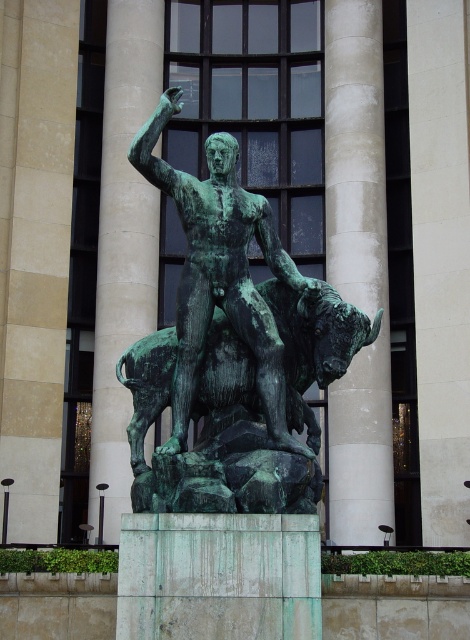
Question: Does smooth stone pillar at center have a lesser width compared to green patina statue at center?

Choices:
 (A) yes
 (B) no

Answer: (A)

Question: Considering the real-world distances, which object is farthest from the smooth stone pillar at center?

Choices:
 (A) green patina statue at center
 (B) green marble pillar at center

Answer: (A)

Question: Does smooth stone pillar at center have a lesser width compared to green patina statue at center?

Choices:
 (A) no
 (B) yes

Answer: (B)

Question: Is green marble pillar at center below green patina statue at center?

Choices:
 (A) yes
 (B) no

Answer: (B)

Question: Which object appears closest to the camera in this image?

Choices:
 (A) smooth stone pillar at center
 (B) green patina statue at center

Answer: (B)

Question: Which of the following is the farthest from the observer?

Choices:
 (A) (237, 252)
 (B) (117, 12)

Answer: (B)